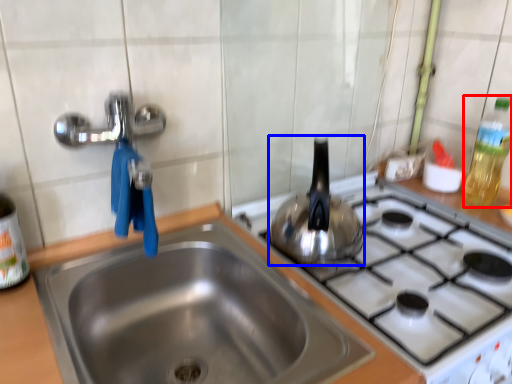
Question: Which object appears farthest to the camera in this image, bottle (highlighted by a red box) or tea pot (highlighted by a blue box)?

Choices:
 (A) bottle
 (B) tea pot

Answer: (A)